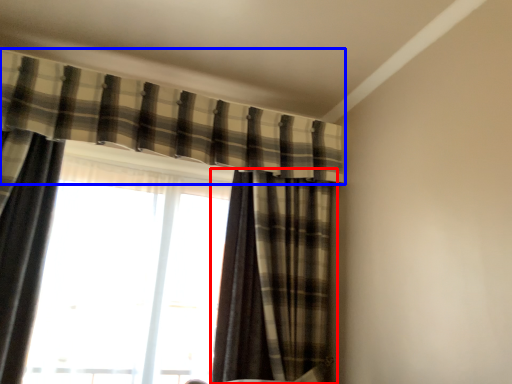
Question: Which point is closer to the camera, curtain (highlighted by a red box) or curtain (highlighted by a blue box)?

Choices:
 (A) curtain
 (B) curtain

Answer: (B)